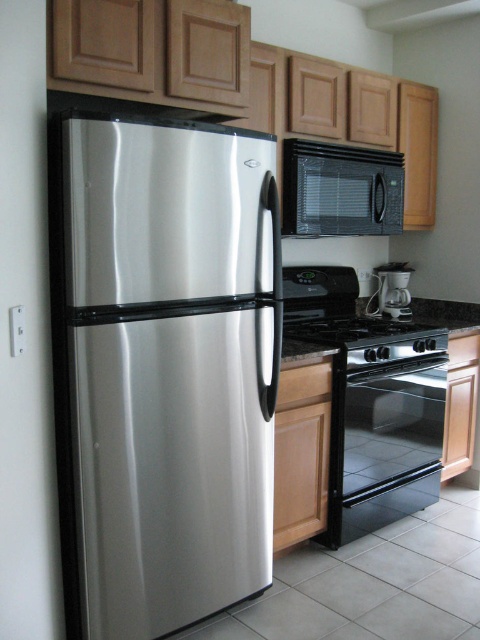
Question: Among these objects, which one is farthest from the camera?

Choices:
 (A) black glossy oven at lower center
 (B) white plastic coffee maker at center
 (C) black glass stove at center
 (D) satin black microwave at upper center

Answer: (B)

Question: Is satin black microwave at upper center wider than white plastic coffee maker at center?

Choices:
 (A) no
 (B) yes

Answer: (B)

Question: Does black glossy oven at lower center appear under white plastic coffee maker at center?

Choices:
 (A) no
 (B) yes

Answer: (B)

Question: Can you confirm if satin black microwave at upper center is bigger than black glass stove at center?

Choices:
 (A) yes
 (B) no

Answer: (A)

Question: Considering the real-world distances, which object is closest to the white plastic coffee maker at center?

Choices:
 (A) black glass stove at center
 (B) black glossy oven at lower center
 (C) stainless steel refrigerator at left

Answer: (A)

Question: Among these points, which one is nearest to the camera?

Choices:
 (A) (408, 339)
 (B) (300, 177)

Answer: (B)